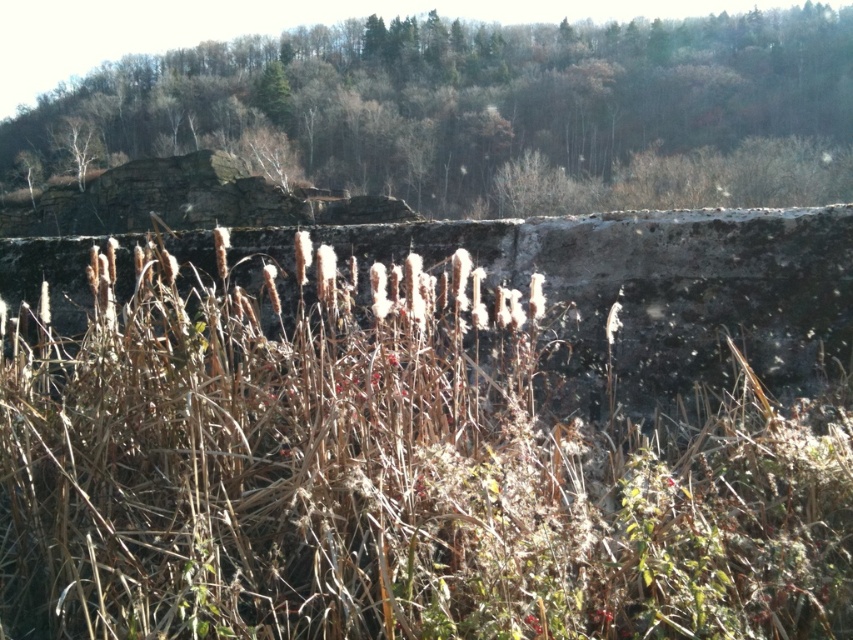
Question: Which object is closer to the camera taking this photo?

Choices:
 (A) brown dry grass at center
 (B) brown grass at center

Answer: (B)

Question: Is brown grass at center thinner than brown dry grass at center?

Choices:
 (A) yes
 (B) no

Answer: (A)

Question: Among these objects, which one is nearest to the camera?

Choices:
 (A) brown dry grass at center
 (B) brown grass at center

Answer: (B)

Question: Is brown grass at center wider than brown dry grass at center?

Choices:
 (A) yes
 (B) no

Answer: (B)

Question: Can you confirm if brown grass at center is bigger than brown dry grass at center?

Choices:
 (A) no
 (B) yes

Answer: (A)